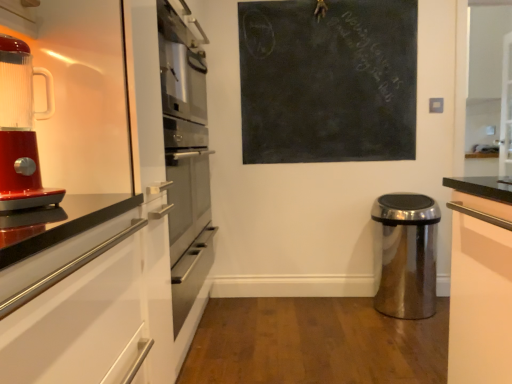
Measure the distance between point (44, 200) and camera.

A distance of 3.29 feet exists between point (44, 200) and camera.

This screenshot has height=384, width=512. Describe the element at coordinates (21, 129) in the screenshot. I see `shiny red blender at left` at that location.

What are the coordinates of `black chalkboard at upper center` in the screenshot? It's located at (328, 80).

From the image's perspective, is shiny red blender at left positioned above or below polished stainless steel trash can at lower right?

shiny red blender at left is above polished stainless steel trash can at lower right.

Considering the points (51, 105) and (433, 294), which point is behind, point (51, 105) or point (433, 294)?

The point (433, 294) is farther.

From the picture: Can you tell me how much shiny red blender at left and polished stainless steel trash can at lower right differ in facing direction?

The angular difference between shiny red blender at left and polished stainless steel trash can at lower right is 63.4 degrees.

How distant is shiny red blender at left from polished stainless steel trash can at lower right?

shiny red blender at left and polished stainless steel trash can at lower right are 2.11 meters apart from each other.

Is black chalkboard at upper center inside or outside of polished stainless steel trash can at lower right?

black chalkboard at upper center lies outside polished stainless steel trash can at lower right.

Considering the sizes of objects black chalkboard at upper center and polished stainless steel trash can at lower right in the image provided, who is thinner, black chalkboard at upper center or polished stainless steel trash can at lower right?

black chalkboard at upper center is thinner.

How different are the orientations of black chalkboard at upper center and polished stainless steel trash can at lower right in degrees?

The angle between the facing direction of black chalkboard at upper center and the facing direction of polished stainless steel trash can at lower right is 0.88 degrees.

Does black chalkboard at upper center come behind polished stainless steel trash can at lower right?

That is True.

In the image, is polished stainless steel trash can at lower right on the left side or the right side of shiny red blender at left?

In the image, polished stainless steel trash can at lower right appears on the right side of shiny red blender at left.

Are polished stainless steel trash can at lower right and shiny red blender at left making contact?

polished stainless steel trash can at lower right is not next to shiny red blender at left, and they're not touching.

Does polished stainless steel trash can at lower right have a greater height compared to shiny red blender at left?

Correct, polished stainless steel trash can at lower right is much taller as shiny red blender at left.

Consider the image. Are polished stainless steel trash can at lower right and black chalkboard at upper center making contact?

No, polished stainless steel trash can at lower right is not with black chalkboard at upper center.

Is polished stainless steel trash can at lower right in front of or behind black chalkboard at upper center in the image?

Visually, polished stainless steel trash can at lower right is located in front of black chalkboard at upper center.

Would you say polished stainless steel trash can at lower right is inside or outside black chalkboard at upper center?

polished stainless steel trash can at lower right lies outside black chalkboard at upper center.

Which is less distant, (395, 298) or (338, 88)?

Clearly, point (395, 298) is more distant from the camera than point (338, 88).

Can you confirm if shiny red blender at left is bigger than black chalkboard at upper center?

No.

Which object is thinner, shiny red blender at left or black chalkboard at upper center?

black chalkboard at upper center is thinner.

Is shiny red blender at left shorter than black chalkboard at upper center?

Yes, shiny red blender at left is shorter than black chalkboard at upper center.

From the image's perspective, which is below, shiny red blender at left or black chalkboard at upper center?

shiny red blender at left appears lower in the image.

You are a GUI agent. You are given a task and a screenshot of the screen. Output one action in this format:
    pyautogui.click(x=<x>, y=<y>)
    Task: Click on the bulletin board above the shiny red blender at left (from a real-world perspective)
    
    Given the screenshot: What is the action you would take?
    pyautogui.click(x=328, y=80)

From a real-world perspective, is black chalkboard at upper center positioned above or below shiny red blender at left?

black chalkboard at upper center is situated higher than shiny red blender at left in the real world.

How far apart are black chalkboard at upper center and shiny red blender at left?

A distance of 1.86 meters exists between black chalkboard at upper center and shiny red blender at left.

Would you say black chalkboard at upper center is a long distance from shiny red blender at left?

Absolutely, black chalkboard at upper center is distant from shiny red blender at left.

The image size is (512, 384). I want to click on waste container on the right side of shiny red blender at left, so click(406, 255).

Locate an element on the screen. bulletin board behind the polished stainless steel trash can at lower right is located at coordinates (328, 80).

Based on their spatial positions, is shiny red blender at left or black chalkboard at upper center further from polished stainless steel trash can at lower right?

shiny red blender at left is positioned further to the anchor polished stainless steel trash can at lower right.

In the scene shown: Estimate the real-world distances between objects in this image. Which object is further from shiny red blender at left, black chalkboard at upper center or polished stainless steel trash can at lower right?

polished stainless steel trash can at lower right is positioned further to the anchor shiny red blender at left.

Which object lies further to the anchor point shiny red blender at left, polished stainless steel trash can at lower right or black chalkboard at upper center?

Among the two, polished stainless steel trash can at lower right is located further to shiny red blender at left.

When comparing their distances from polished stainless steel trash can at lower right, does black chalkboard at upper center or shiny red blender at left seem closer?

Among the two, black chalkboard at upper center is located nearer to polished stainless steel trash can at lower right.

When comparing their distances from black chalkboard at upper center, does shiny red blender at left or polished stainless steel trash can at lower right seem further?

Based on the image, shiny red blender at left appears to be further to black chalkboard at upper center.

Considering their positions, is polished stainless steel trash can at lower right positioned further to black chalkboard at upper center than shiny red blender at left?

The object further to black chalkboard at upper center is shiny red blender at left.

The width and height of the screenshot is (512, 384). What are the coordinates of `waste container located between shiny red blender at left and black chalkboard at upper center in the depth direction` in the screenshot? It's located at (406, 255).